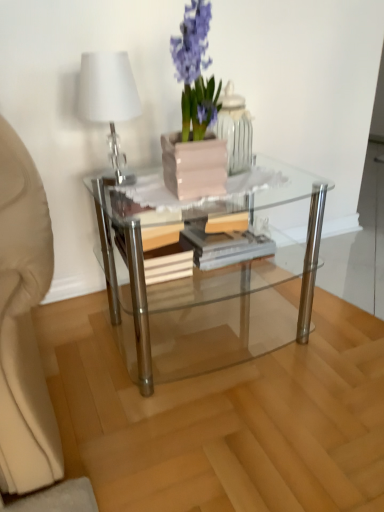
In order to click on vacant area to the right of transparent glass coffee table at center in this screenshot , I will do `click(331, 327)`.